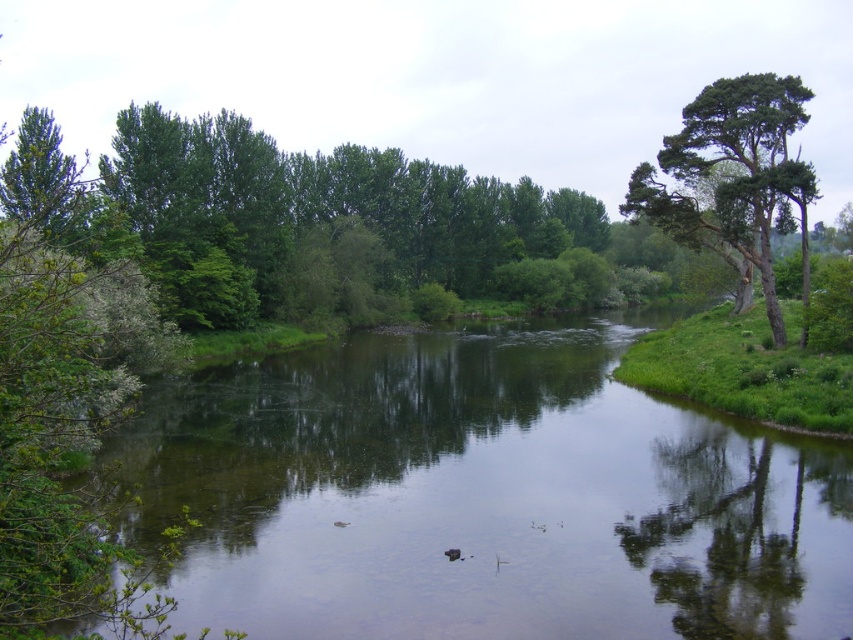
Find the location of `green smooth water at center`. green smooth water at center is located at coordinates (479, 497).

Consider the image. Does green smooth water at center have a lesser height compared to green rough bark tree at upper right?

Correct, green smooth water at center is not as tall as green rough bark tree at upper right.

Find the location of a particular element. green smooth water at center is located at coordinates (479, 497).